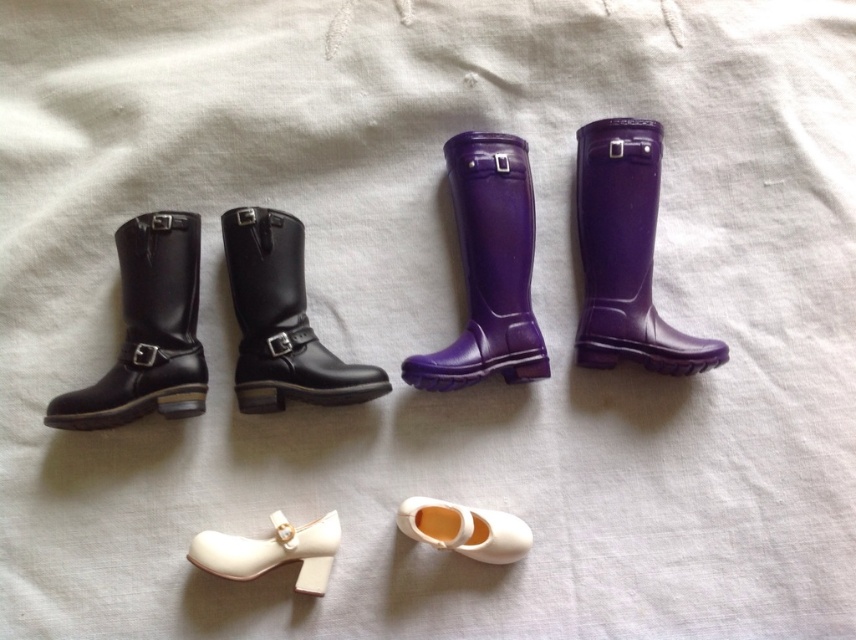
Question: Does white matte shoe at lower center appear under white leather shoe at lower center?

Choices:
 (A) yes
 (B) no

Answer: (A)

Question: Does black leather boot at left come in front of white leather shoe at lower center?

Choices:
 (A) no
 (B) yes

Answer: (B)

Question: Which object is closer to the camera taking this photo?

Choices:
 (A) black leather boot at center
 (B) white matte shoe at lower center

Answer: (B)

Question: In this image, where is glossy rubber boot at upper right located relative to white leather shoe at lower center?

Choices:
 (A) left
 (B) right

Answer: (B)

Question: Which object is closer to the camera taking this photo?

Choices:
 (A) white leather shoe at lower center
 (B) black leather boot at center

Answer: (A)

Question: Which point appears closest to the camera in this image?

Choices:
 (A) (642, 157)
 (B) (260, 572)

Answer: (B)